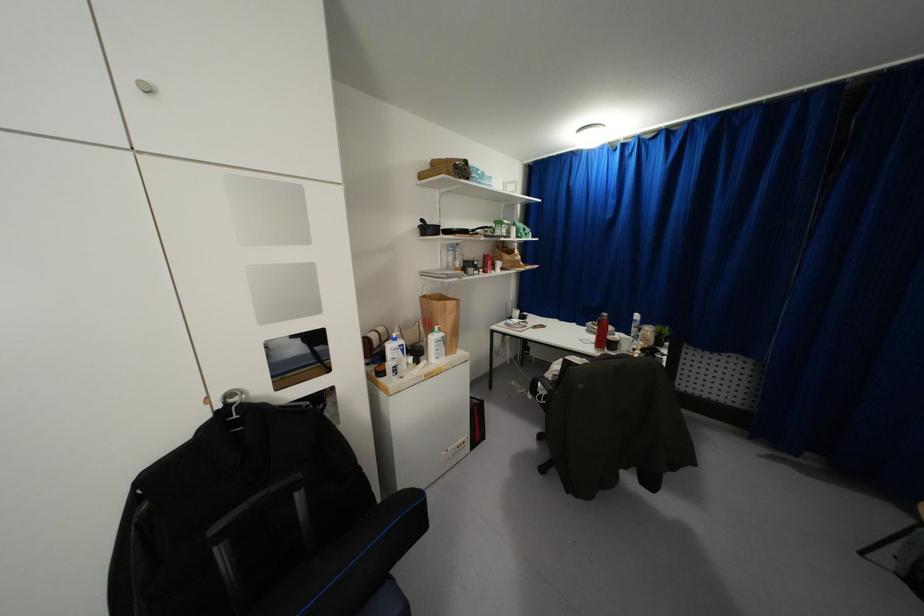
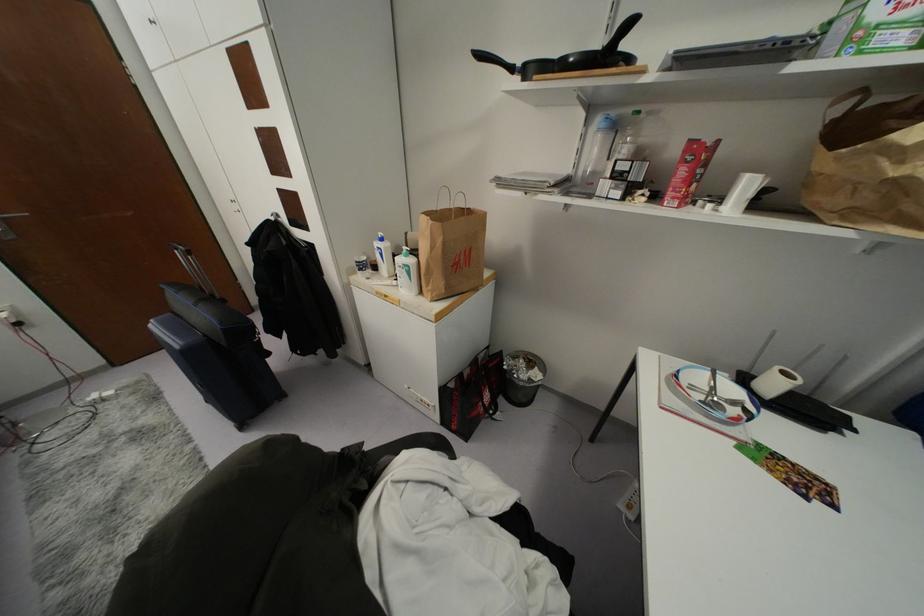
Locate, in the second image, the point that corresponds to [446,249] in the first image.

(599, 130)